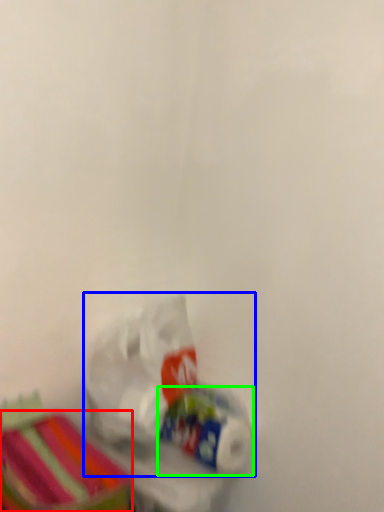
Question: Considering the real-world distances, which object is closest to storage box (highlighted by a red box)? plastic bag (highlighted by a blue box) or toilet paper (highlighted by a green box).

Choices:
 (A) plastic bag
 (B) toilet paper

Answer: (A)